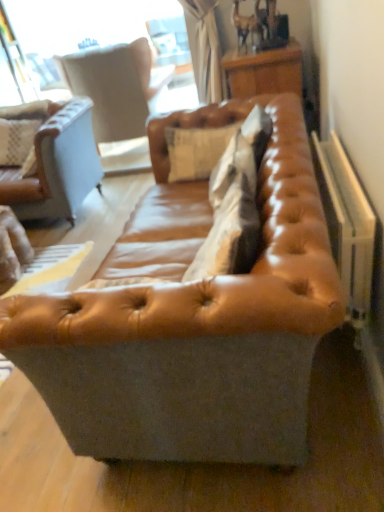
Question: Can you confirm if white plastic radiator at right is thinner than light beige leather swivel chair at upper left?

Choices:
 (A) yes
 (B) no

Answer: (A)

Question: From a real-world perspective, does white plastic radiator at right stand above light beige leather swivel chair at upper left?

Choices:
 (A) no
 (B) yes

Answer: (A)

Question: Is white plastic radiator at right taller than light beige leather swivel chair at upper left?

Choices:
 (A) yes
 (B) no

Answer: (B)

Question: Is the surface of white plastic radiator at right in direct contact with light beige leather swivel chair at upper left?

Choices:
 (A) yes
 (B) no

Answer: (B)

Question: From the image's perspective, is white plastic radiator at right above light beige leather swivel chair at upper left?

Choices:
 (A) no
 (B) yes

Answer: (A)

Question: Does white plastic radiator at right have a greater width compared to light beige leather swivel chair at upper left?

Choices:
 (A) yes
 (B) no

Answer: (B)

Question: Can you confirm if white plastic radiator at right is bigger than leather cushion at center?

Choices:
 (A) no
 (B) yes

Answer: (B)

Question: From a real-world perspective, is white plastic radiator at right located higher than leather cushion at center?

Choices:
 (A) yes
 (B) no

Answer: (B)

Question: From the image's perspective, is white plastic radiator at right located beneath leather cushion at center?

Choices:
 (A) no
 (B) yes

Answer: (B)

Question: Is white plastic radiator at right outside leather cushion at center?

Choices:
 (A) no
 (B) yes

Answer: (B)

Question: Does white plastic radiator at right have a lesser height compared to leather cushion at center?

Choices:
 (A) no
 (B) yes

Answer: (A)

Question: From the image's perspective, would you say white plastic radiator at right is positioned over leather cushion at center?

Choices:
 (A) yes
 (B) no

Answer: (B)

Question: From a real-world perspective, does light beige leather swivel chair at upper left sit lower than leather cushion at center?

Choices:
 (A) no
 (B) yes

Answer: (B)